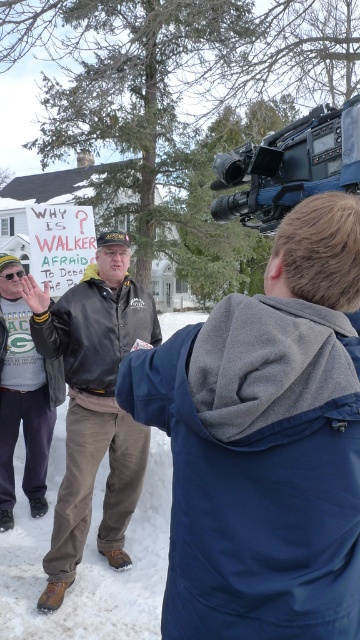
Which of these two, leather jacket at center or black plastic video camera at upper right, stands taller?

With more height is leather jacket at center.

Does point (93, 476) come in front of point (335, 179)?

That is False.

I want to click on leather jacket at center, so click(x=93, y=404).